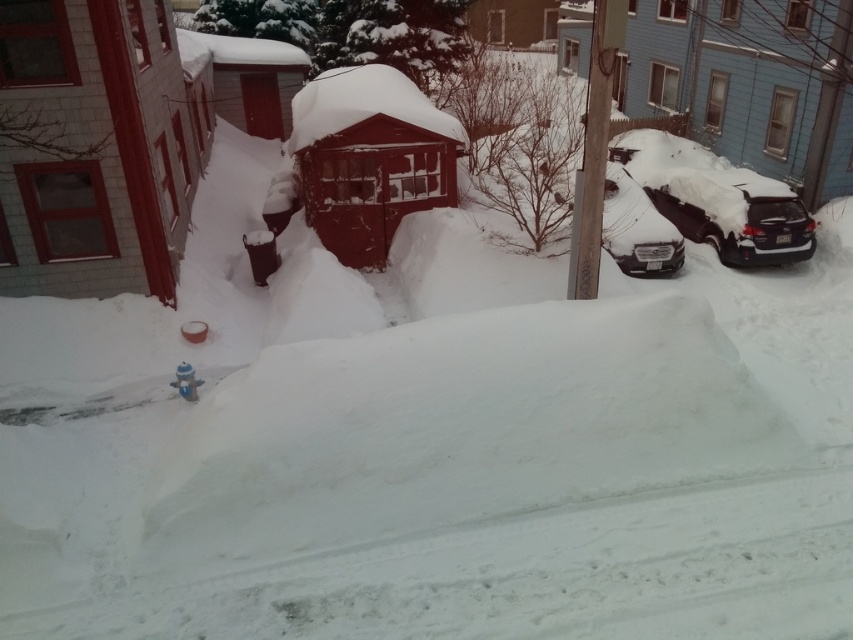
Can you confirm if brown wooden pole at upper right is positioned below blue metallic hydrant at lower center?

No, brown wooden pole at upper right is not below blue metallic hydrant at lower center.

In the scene shown: Does brown wooden pole at upper right have a greater height compared to blue metallic hydrant at lower center?

Yes, brown wooden pole at upper right is taller than blue metallic hydrant at lower center.

Which is in front, point (593, 22) or point (181, 388)?

Point (181, 388)

Where is `brown wooden pole at upper right`? The image size is (853, 640). brown wooden pole at upper right is located at coordinates (593, 148).

Is point (573, 257) in front of point (671, 252)?

Yes, it is in front of point (671, 252).

Can you confirm if brown wooden pole at upper right is positioned below sleek silver sedan at center-right?

No, brown wooden pole at upper right is not below sleek silver sedan at center-right.

Find the location of a particular element. Image resolution: width=853 pixels, height=640 pixels. brown wooden pole at upper right is located at coordinates (593, 148).

Identify the location of brown wooden pole at upper right. This screenshot has width=853, height=640. (593, 148).

Which is in front, point (634, 230) or point (196, 385)?

Point (196, 385) is in front.

Who is higher up, sleek silver sedan at center-right or blue metallic hydrant at lower center?

Positioned higher is sleek silver sedan at center-right.

Is point (619, 257) positioned after point (192, 372)?

That is True.

This screenshot has width=853, height=640. Find the location of `sleek silver sedan at center-right`. sleek silver sedan at center-right is located at coordinates (636, 227).